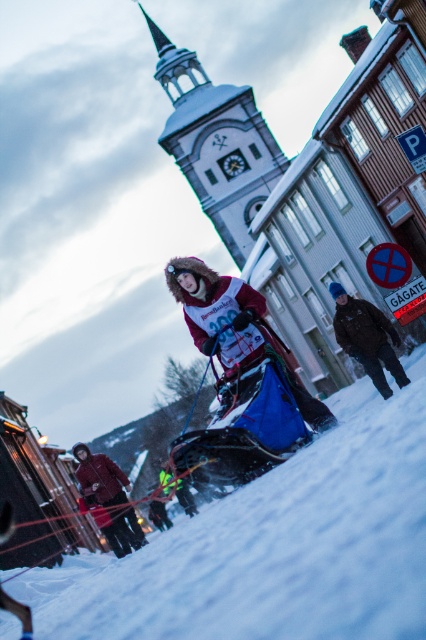
You are a photographer trying to capture the clock tower in the background. You notice two points marked in the image at coordinates point (290, 625) and point (127, 515). Which point is closer to your camera lens?

Point (290, 625) is closer to the camera than point (127, 515).

You are a participant in the snowmobile race and need to locate the clock tower. According to the image, where is the clock tower situated relative to the point marked at coordinates [273,547]?

The clock tower is in the background of the image, which places it behind the point marked at coordinates [273,547].

You are a photographer trying to capture the snowmobile race scene. You need to ensure that both the white powdery snow at center and the matte red jacket at lower left are clearly visible in your shot. Based on their positions, which object should you focus on first to ensure both are in frame?

The white powdery snow at center is wider than the matte red jacket at lower left, so focusing on the white powdery snow at center first will help ensure both are in frame.